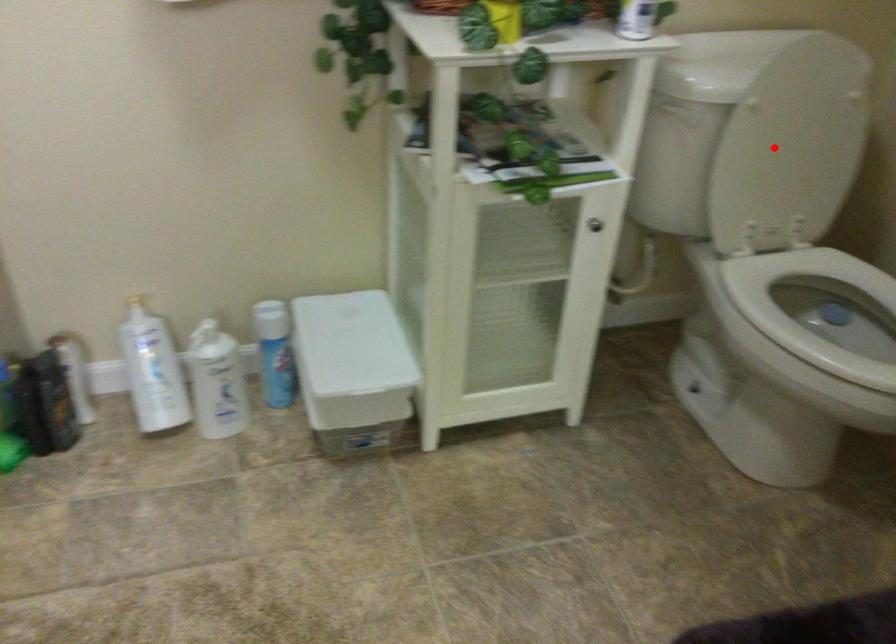
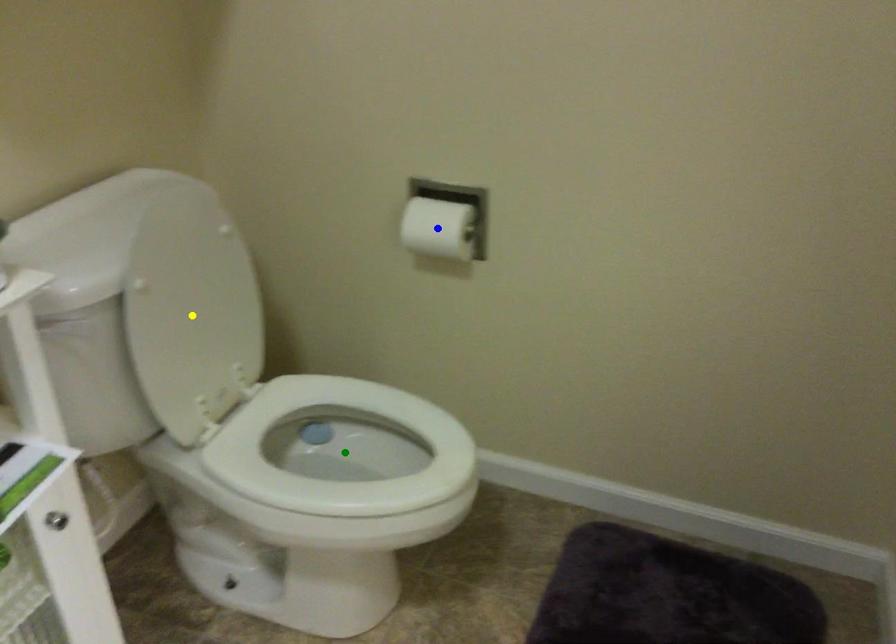
Question: I am providing you with two images of the same scene from different viewpoints. A red point is marked on the first image. You are given multiple points on the second image. Which mark in image 2 goes with the point in image 1?

Choices:
 (A) yellow point
 (B) blue point
 (C) green point

Answer: (A)